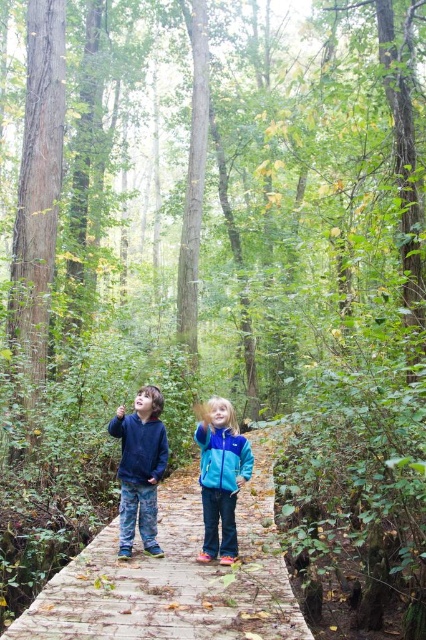
You are a photographer positioned at the end of the boardwalk aiming to capture both the denim pants at center and the matte blue jacket at center in the same frame. Based on their positions, which object should you focus on first to ensure both are in the shot?

The denim pants at center is to the right of the matte blue jacket at center, so you should focus on the matte blue jacket at center first to ensure both are included in the frame.